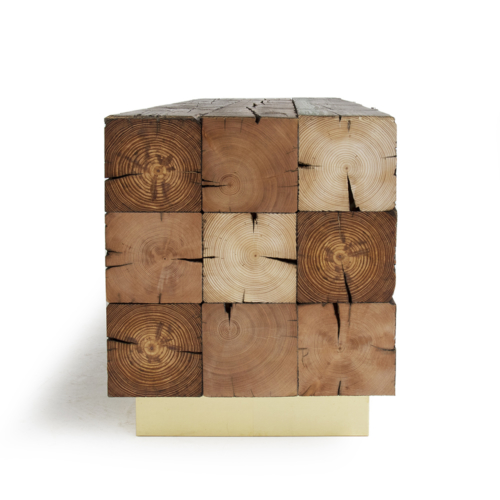
Locate an element on the screen. The height and width of the screenshot is (500, 500). middle bottom board is located at coordinates (254, 352).